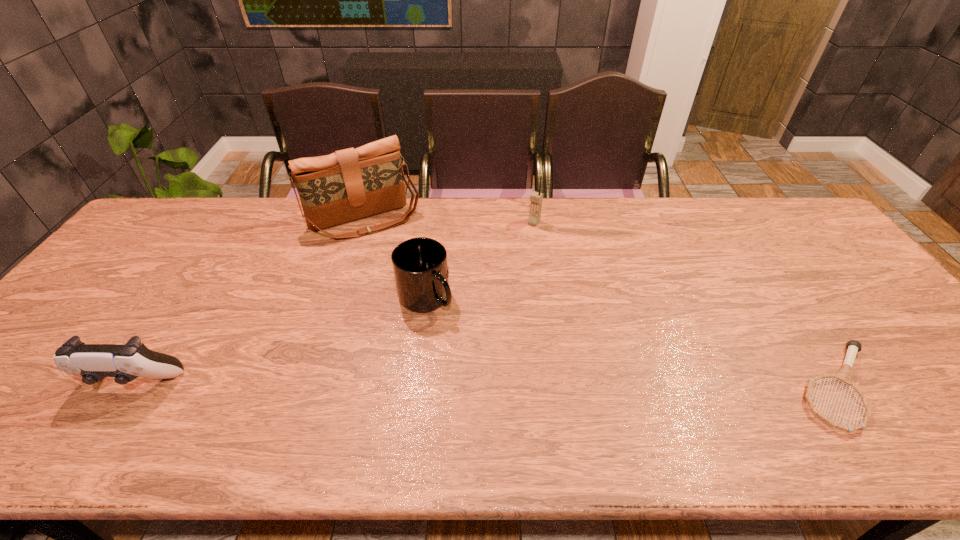
The image size is (960, 540). I want to click on control, so click(x=93, y=362).

At what (x,y) coordinates should I click in order to perform the action: click on tennis racket. Please return your answer as a coordinate pair (x, y). The width and height of the screenshot is (960, 540). Looking at the image, I should click on (844, 376).

This screenshot has width=960, height=540. What are the coordinates of `the shortest object` in the screenshot? It's located at (844, 376).

You are a GUI agent. You are given a task and a screenshot of the screen. Output one action in this format:
    pyautogui.click(x=<x>, y=<y>)
    Task: Click on the third farthest object
    
    Given the screenshot: What is the action you would take?
    pyautogui.click(x=420, y=267)

Where is `the second object from right to left`? Image resolution: width=960 pixels, height=540 pixels. the second object from right to left is located at coordinates (536, 198).

Where is `the fourth shortest object`? the fourth shortest object is located at coordinates tap(536, 198).

Locate an element on the screen. The height and width of the screenshot is (540, 960). shoulder bag is located at coordinates click(350, 184).

Identify the location of free space located 0.310m on the back of the shortest object. The image size is (960, 540). (755, 261).

Identify the location of free region located 0.080m with the handle on the side of the mug. The width and height of the screenshot is (960, 540). (452, 338).

Where is `blank space located 0.230m with the handle on the side of the mug`? blank space located 0.230m with the handle on the side of the mug is located at coordinates (481, 383).